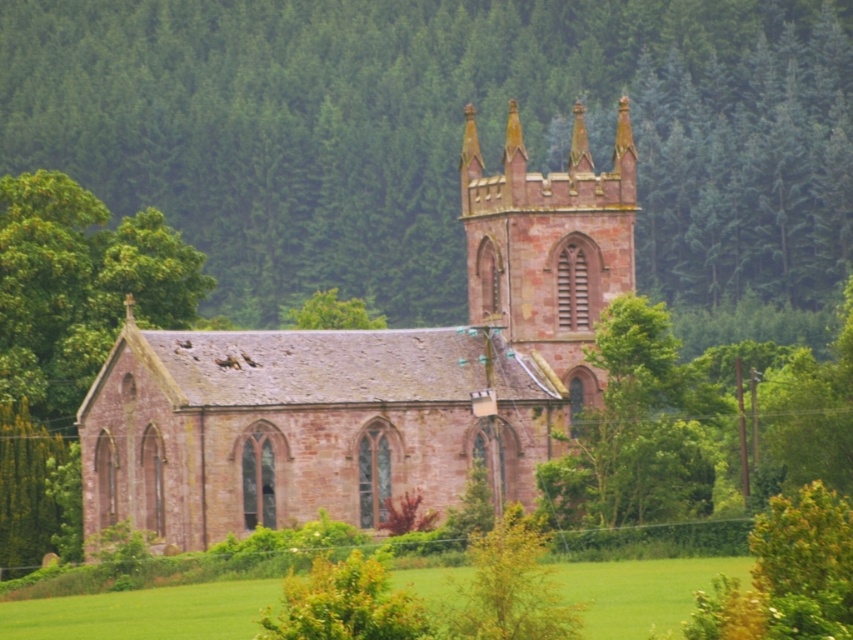
You are standing in the rural scene with the historic stone church. You notice two points marked in the image. Which point, point (428, 122) or point (550, 237), is closer to you?

Point (428, 122) is closer to you because it is further to the viewer than point (550, 237).

You are standing in the rural scene and want to walk from the green leafy tree at center to the green grass at lower center. In which direction should you move relative to the tree?

You should move to the right relative to the green leafy tree at center because the green grass at lower center is positioned on the right side of the tree.